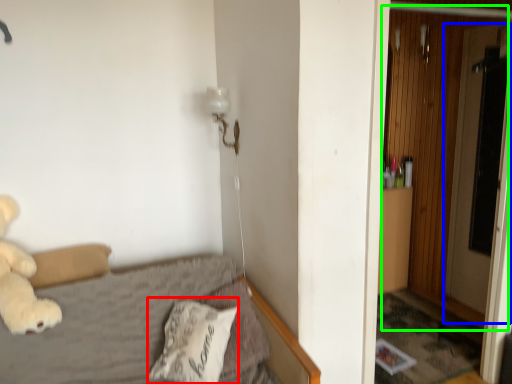
Question: Which is farther away from pillow (highlighted by a red box)? screen door (highlighted by a blue box) or door (highlighted by a green box)?

Choices:
 (A) screen door
 (B) door

Answer: (A)